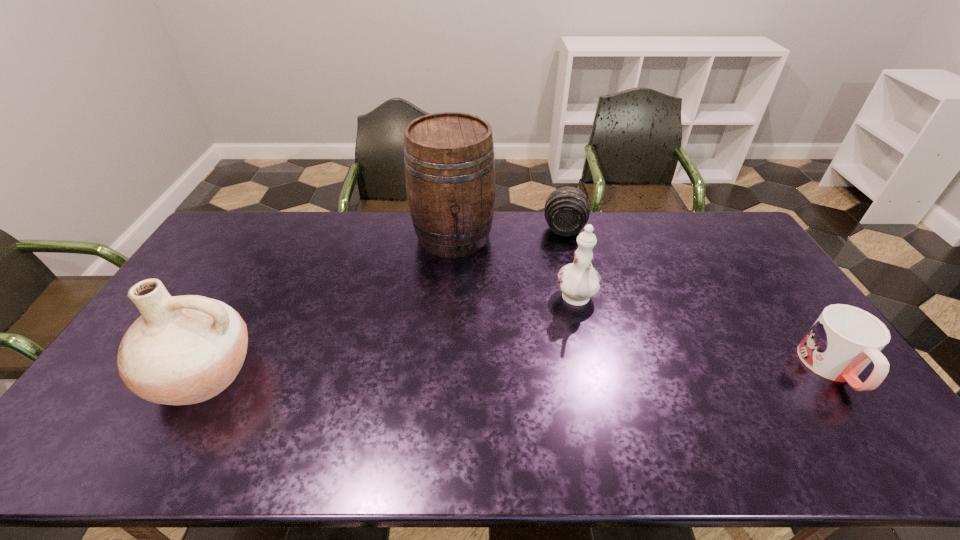
Identify the location of free space on the desktop that is between the pottery and the rightmost object and is positioned at the spout of the third nearest object. (588, 370).

Image resolution: width=960 pixels, height=540 pixels. I want to click on vacant space on the desktop that is between the pottery and the mug and is positioned at the front element of the telephoto lens, so click(x=553, y=371).

In order to click on vacant space on the desktop that is between the leftmost object and the rightmost object and is positioned on the side of the cider near the bung hole in this screenshot , I will do `click(473, 372)`.